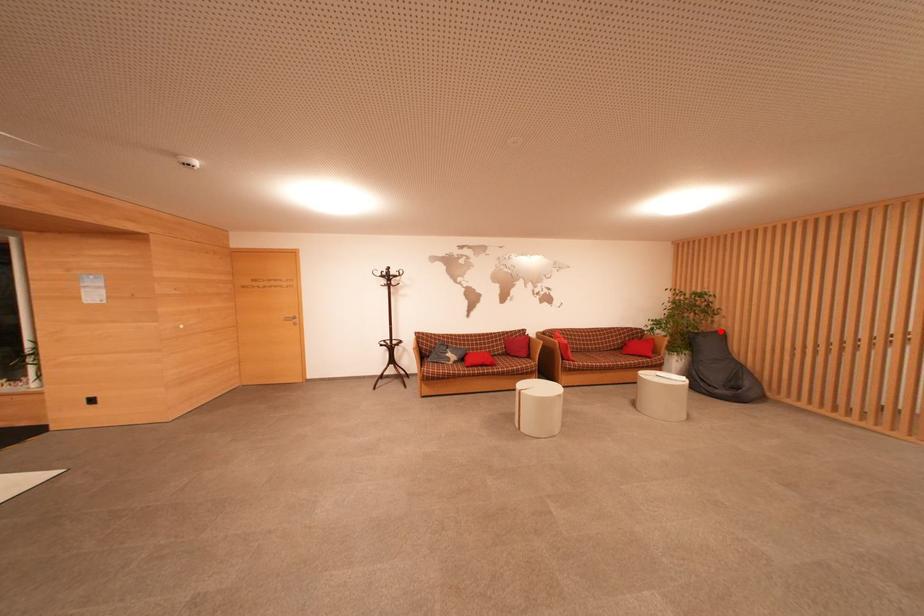
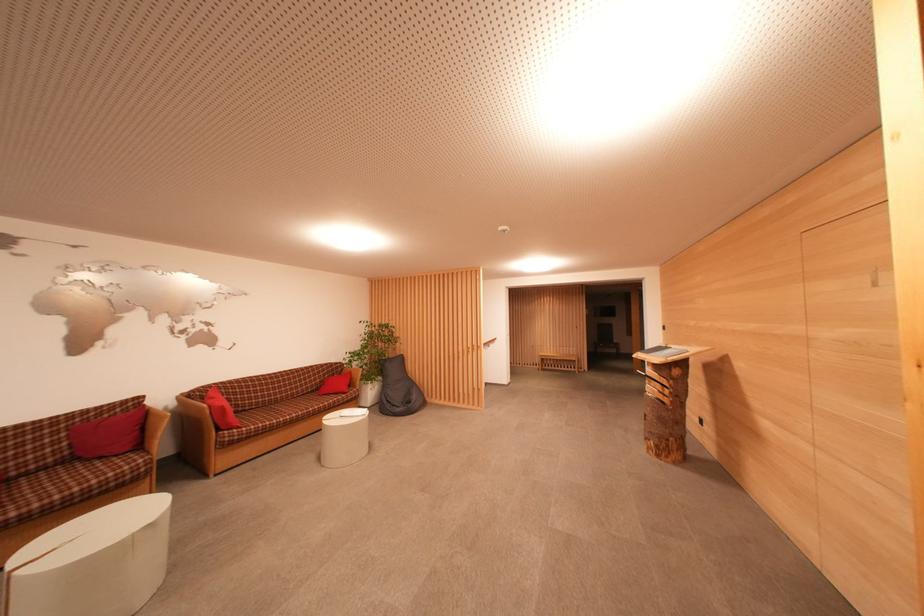
The point at the highlighted location is marked in the first image. Where is the corresponding point in the second image?

(402, 357)